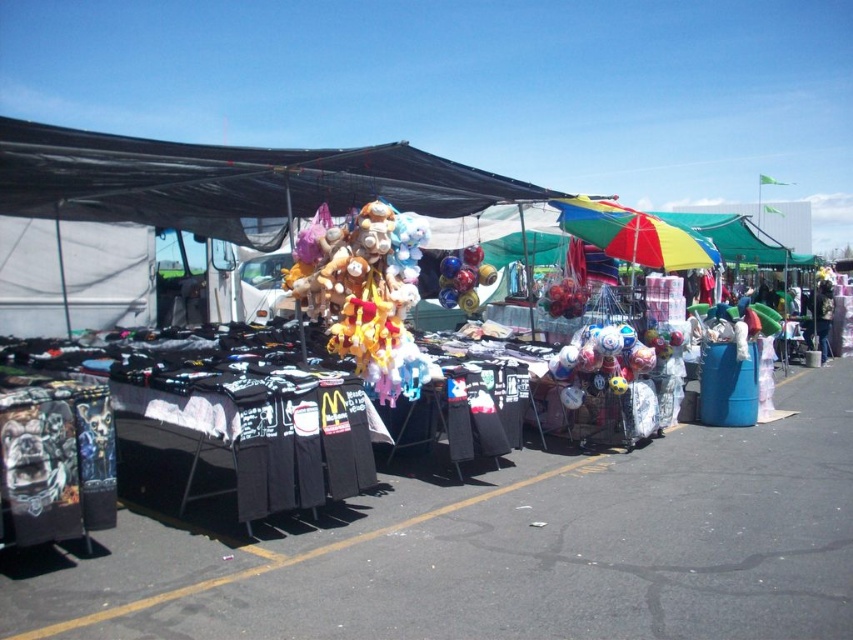
You are a customer at the outdoor market and want to buy a plush toy. You see two options, the fluffy plush toys at center and the fluffy plush at center. Which one is placed higher?

The fluffy plush toys at center is positioned over the fluffy plush at center, so it is placed higher.

You are standing at point (227, 180) in the market. What item is located exactly at your current position?

The black fabric t shirts at center are located exactly at point (227, 180).